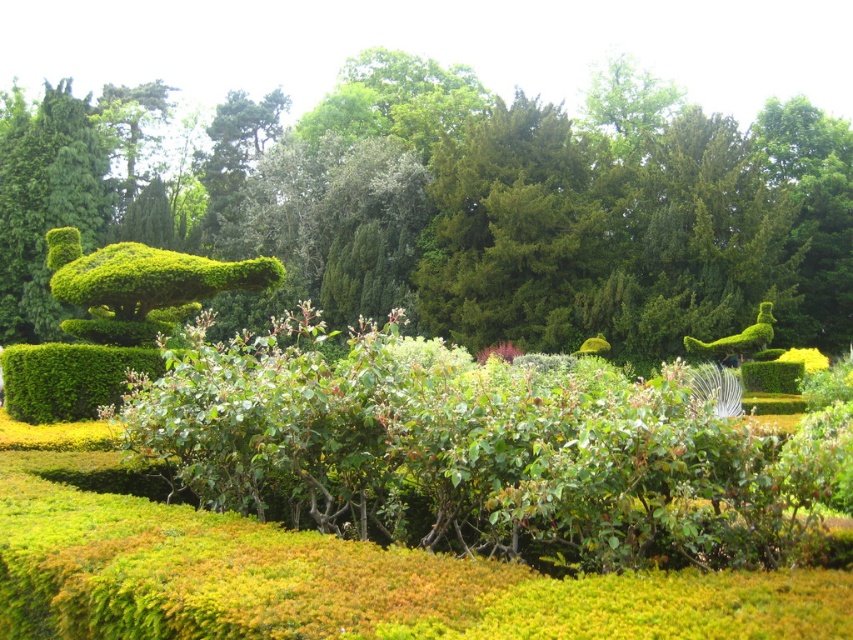
Identify the location of green bushy hedge at center. (531, 211).

Is green bushy hedge at center bigger than yellow matte flower at center-right?

Indeed, green bushy hedge at center has a larger size compared to yellow matte flower at center-right.

Is point (844, 129) positioned in front of point (798, 352)?

No, (844, 129) is behind (798, 352).

You are a GUI agent. You are given a task and a screenshot of the screen. Output one action in this format:
    pyautogui.click(x=<x>, y=<y>)
    Task: Click on the green bushy hedge at center
    This screenshot has height=640, width=853.
    Given the screenshot: What is the action you would take?
    pyautogui.click(x=531, y=211)